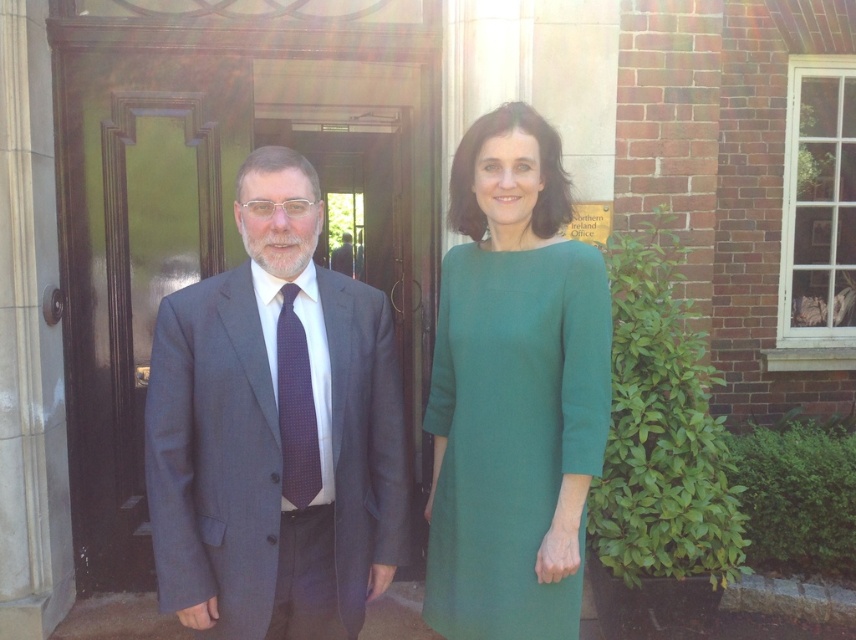
Question: Is matte gray suit at center to the left of purple dotted tie at center from the viewer's perspective?

Choices:
 (A) no
 (B) yes

Answer: (B)

Question: Which point is farther to the camera?

Choices:
 (A) (306, 355)
 (B) (229, 483)

Answer: (A)

Question: Which object appears farthest from the camera in this image?

Choices:
 (A) matte gray suit at center
 (B) purple dotted tie at center
 (C) green woolen dress at center

Answer: (B)

Question: Is green woolen dress at center below purple dotted tie at center?

Choices:
 (A) yes
 (B) no

Answer: (A)

Question: Can you confirm if matte gray suit at center is smaller than green woolen dress at center?

Choices:
 (A) yes
 (B) no

Answer: (B)

Question: Which of the following is the closest to the observer?

Choices:
 (A) (515, 532)
 (B) (317, 481)

Answer: (A)